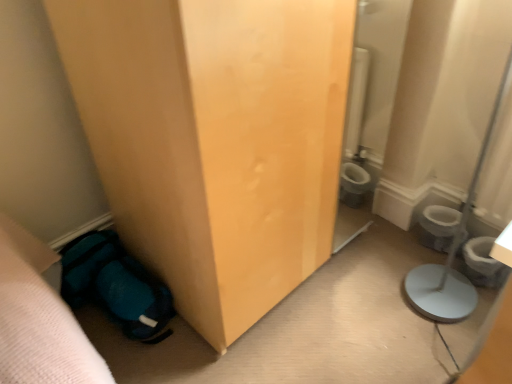
Question: From the image's perspective, is white glossy toilet bowl at lower right on white plastic potty at lower right?

Choices:
 (A) no
 (B) yes

Answer: (B)

Question: From a real-world perspective, does white glossy toilet bowl at lower right stand above white plastic potty at lower right?

Choices:
 (A) no
 (B) yes

Answer: (A)

Question: Does white glossy toilet bowl at lower right appear on the left side of white plastic potty at lower right?

Choices:
 (A) yes
 (B) no

Answer: (A)

Question: Can you confirm if white glossy toilet bowl at lower right is taller than white plastic potty at lower right?

Choices:
 (A) yes
 (B) no

Answer: (A)

Question: From a real-world perspective, is white glossy toilet bowl at lower right physically below white plastic potty at lower right?

Choices:
 (A) yes
 (B) no

Answer: (A)

Question: Looking at their shapes, would you say teal fabric sleeping bag at lower left is wider or thinner than white plastic potty at lower right?

Choices:
 (A) wide
 (B) thin

Answer: (A)

Question: Which is correct: teal fabric sleeping bag at lower left is inside white plastic potty at lower right, or outside of it?

Choices:
 (A) inside
 (B) outside

Answer: (B)

Question: Based on their positions, is teal fabric sleeping bag at lower left located to the left or right of white plastic potty at lower right?

Choices:
 (A) left
 (B) right

Answer: (A)

Question: From a real-world perspective, is teal fabric sleeping bag at lower left positioned above or below white plastic potty at lower right?

Choices:
 (A) below
 (B) above

Answer: (B)

Question: Is teal fabric sleeping bag at lower left taller or shorter than white glossy toilet bowl at lower right?

Choices:
 (A) short
 (B) tall

Answer: (A)

Question: Is point (143, 306) positioned closer to the camera than point (443, 249)?

Choices:
 (A) farther
 (B) closer

Answer: (B)

Question: Is teal fabric sleeping bag at lower left inside the boundaries of white glossy toilet bowl at lower right, or outside?

Choices:
 (A) inside
 (B) outside

Answer: (B)

Question: Is teal fabric sleeping bag at lower left bigger or smaller than white glossy toilet bowl at lower right?

Choices:
 (A) big
 (B) small

Answer: (A)

Question: Choose the correct answer: Is white glossy toilet bowl at lower right inside white plastic potty at lower right or outside it?

Choices:
 (A) inside
 (B) outside

Answer: (B)

Question: From a real-world perspective, is white glossy toilet bowl at lower right positioned above or below white plastic potty at lower right?

Choices:
 (A) above
 (B) below

Answer: (B)